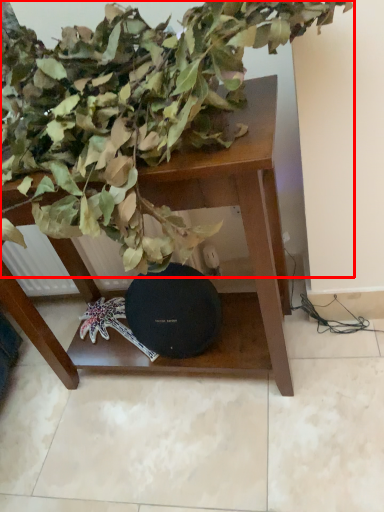
Question: From the image's perspective, considering the relative positions of houseplant (annotated by the red box) and table in the image provided, where is houseplant (annotated by the red box) located with respect to the staircase?

Choices:
 (A) above
 (B) below

Answer: (A)